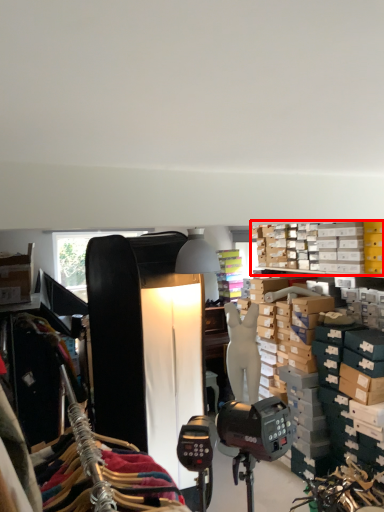
Question: From the image's perspective, where is shelf (annotated by the red box) located in relation to mannequin in the image?

Choices:
 (A) above
 (B) below

Answer: (A)